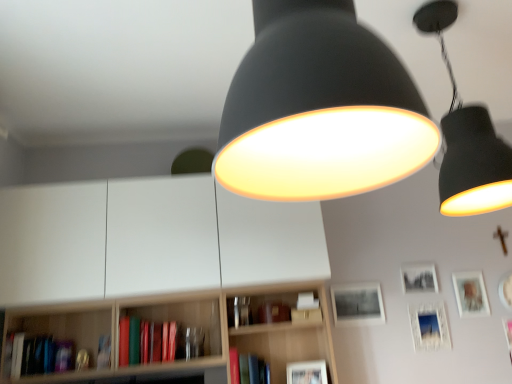
Question: From a real-world perspective, is matte white picture frame at upper right, placed as the fifth picture frame when sorted from left to right, on hardcover book at lower left, the second book from the left?

Choices:
 (A) no
 (B) yes

Answer: (B)

Question: Is matte white picture frame at upper right, which appears as the 1th picture frame when viewed from the right, far from hardcover book at lower left, marked as the third book in a right-to-left arrangement?

Choices:
 (A) no
 (B) yes

Answer: (B)

Question: Does matte white picture frame at upper right, which appears as the 1th picture frame when viewed from the right, appear on the left side of hardcover book at lower left, marked as the third book in a right-to-left arrangement?

Choices:
 (A) yes
 (B) no

Answer: (B)

Question: Does matte white picture frame at upper right, placed as the fifth picture frame when sorted from left to right, have a greater height compared to hardcover book at lower left, marked as the third book in a right-to-left arrangement?

Choices:
 (A) no
 (B) yes

Answer: (B)

Question: Is matte white picture frame at upper right, which appears as the 1th picture frame when viewed from the right, turned away from hardcover book at lower left, marked as the third book in a right-to-left arrangement?

Choices:
 (A) yes
 (B) no

Answer: (B)

Question: Does matte white picture frame at upper right, placed as the fifth picture frame when sorted from left to right, have a larger size compared to hardcover book at lower left, the second book from the left?

Choices:
 (A) yes
 (B) no

Answer: (A)

Question: From the image's perspective, is matte brown book at center, placed as the first book when sorted from right to left, on top of matte black lampshade at upper right, the first lamp when ordered from right to left?

Choices:
 (A) yes
 (B) no

Answer: (B)

Question: From a real-world perspective, does matte brown book at center, the 4th book viewed from the left, sit lower than matte black lampshade at upper right, which is the second lamp from left to right?

Choices:
 (A) yes
 (B) no

Answer: (A)

Question: Is matte black lampshade at upper right, the first lamp when ordered from right to left, completely or partially inside matte brown book at center, the 4th book viewed from the left?

Choices:
 (A) no
 (B) yes

Answer: (A)

Question: Considering the relative sizes of matte brown book at center, placed as the first book when sorted from right to left, and matte black lampshade at upper right, which is the second lamp from left to right, in the image provided, is matte brown book at center, placed as the first book when sorted from right to left, wider than matte black lampshade at upper right, which is the second lamp from left to right,?

Choices:
 (A) no
 (B) yes

Answer: (A)

Question: Can you confirm if matte brown book at center, placed as the first book when sorted from right to left, is positioned to the right of matte black lampshade at upper right, which is the second lamp from left to right?

Choices:
 (A) no
 (B) yes

Answer: (A)

Question: Is matte brown book at center, placed as the first book when sorted from right to left, far away from matte black lampshade at upper right, the first lamp in the back-to-front sequence?

Choices:
 (A) yes
 (B) no

Answer: (A)

Question: Does matte black lampshade at upper center, which appears as the 2th lamp when viewed from the right, have a lesser height compared to matte white picture frame at lower right, the 4th picture frame viewed from the left?

Choices:
 (A) yes
 (B) no

Answer: (B)